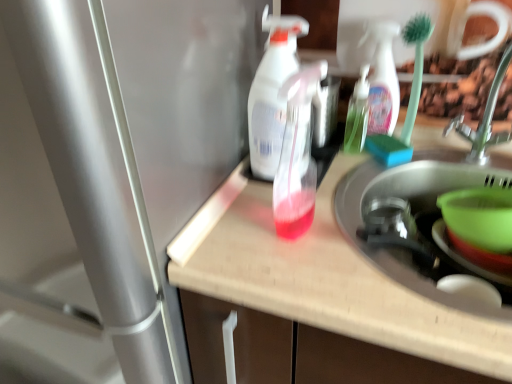
The width and height of the screenshot is (512, 384). What are the coordinates of `vacant position to the left of translucent plastic spray bottle at center, which appears as the second bottle when viewed from the right` in the screenshot? It's located at (232, 234).